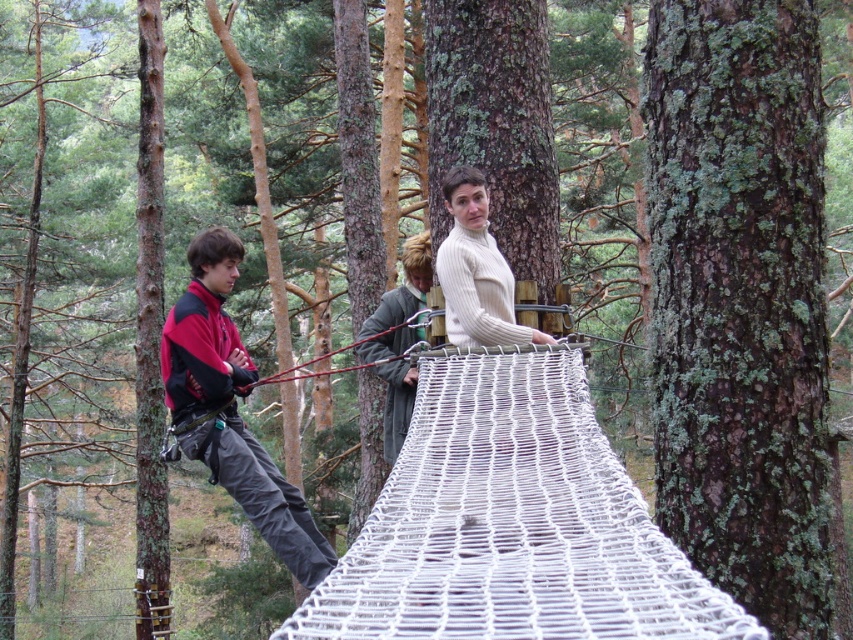
Question: Is brown rough bark at center behind red fleece jacket at left?

Choices:
 (A) yes
 (B) no

Answer: (B)

Question: Does brown rough bark at center come in front of white ribbed sweater at center?

Choices:
 (A) no
 (B) yes

Answer: (B)

Question: Which object is the farthest from the red fleece jacket at left?

Choices:
 (A) brown rough bark at center
 (B) white ribbed sweater at center

Answer: (A)

Question: Which object is positioned closest to the brown rough bark at center?

Choices:
 (A) red fleece jacket at left
 (B) white ribbed sweater at center

Answer: (B)

Question: Can you confirm if red fleece jacket at left is positioned above white ribbed sweater at center?

Choices:
 (A) yes
 (B) no

Answer: (B)

Question: Considering the real-world distances, which object is closest to the white ribbed sweater at center?

Choices:
 (A) red fleece jacket at left
 (B) brown rough bark at center

Answer: (B)